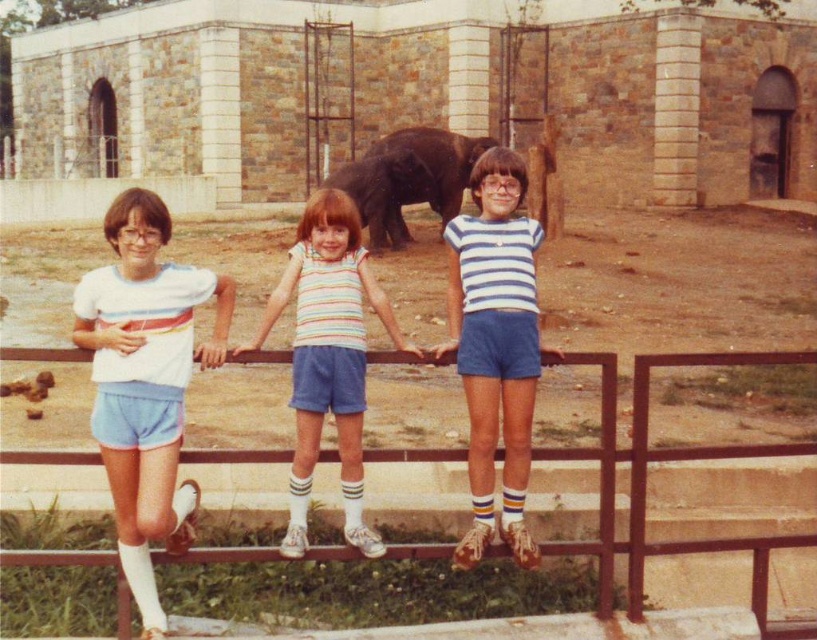
How much distance is there between metallic brown fence at center and striped fabric shorts at center?

2.24 meters

Does metallic brown fence at center appear over striped fabric shorts at center?

Actually, metallic brown fence at center is below striped fabric shorts at center.

Identify the location of metallic brown fence at center. (666, 460).

Which of these two, white cotton shorts at left or blue striped shirt at center, stands taller?

Standing taller between the two is blue striped shirt at center.

Is white cotton shorts at left wider than blue striped shirt at center?

In fact, white cotton shorts at left might be narrower than blue striped shirt at center.

Between point (141, 323) and point (523, 273), which one is positioned in front?

Point (141, 323) is more forward.

The height and width of the screenshot is (640, 817). What are the coordinates of `white cotton shorts at left` in the screenshot? It's located at (145, 381).

Based on the photo, can you confirm if white cotton shorts at left is bigger than dark brown elephant at center?

Incorrect, white cotton shorts at left is not larger than dark brown elephant at center.

Can you confirm if white cotton shorts at left is thinner than dark brown elephant at center?

Indeed, white cotton shorts at left has a lesser width compared to dark brown elephant at center.

Between point (166, 268) and point (391, 168), which one is positioned behind?

Point (391, 168)

You are a GUI agent. You are given a task and a screenshot of the screen. Output one action in this format:
    pyautogui.click(x=<x>, y=<y>)
    Task: Click on the white cotton shorts at left
    
    Given the screenshot: What is the action you would take?
    tap(145, 381)